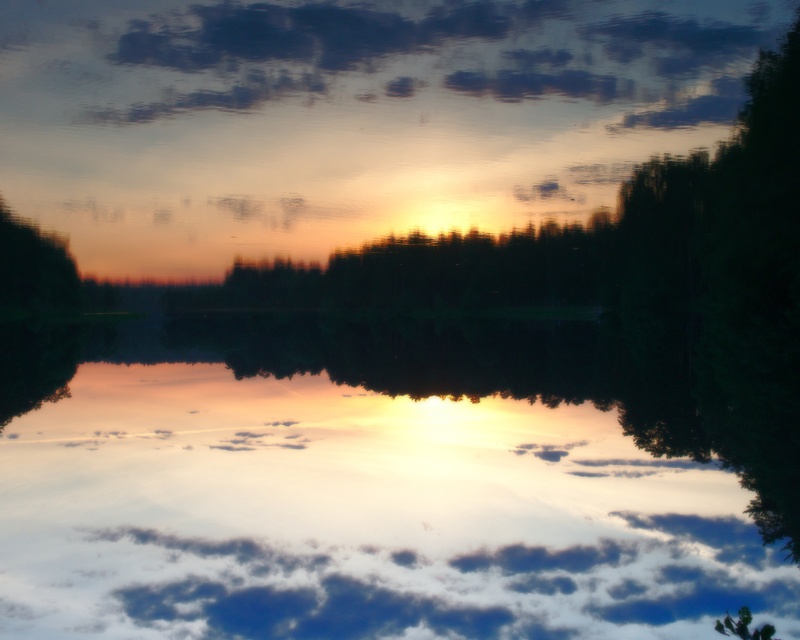
Question: Does transparent water at center have a lesser width compared to cloudy sky at upper center?

Choices:
 (A) no
 (B) yes

Answer: (B)

Question: Which point is farther to the camera?

Choices:
 (A) cloudy sky at upper center
 (B) transparent water at center
 (C) green matte tree at left

Answer: (C)

Question: Which point appears closest to the camera in this image?

Choices:
 (A) coord(152,88)
 (B) coord(10,278)
 (C) coord(128,353)

Answer: (C)

Question: Can you confirm if transparent water at center is positioned above green matte tree at left?

Choices:
 (A) no
 (B) yes

Answer: (A)

Question: Which point is farther to the camera?

Choices:
 (A) transparent water at center
 (B) cloudy sky at upper center

Answer: (B)

Question: Is cloudy sky at upper center bigger than green matte tree at left?

Choices:
 (A) yes
 (B) no

Answer: (A)